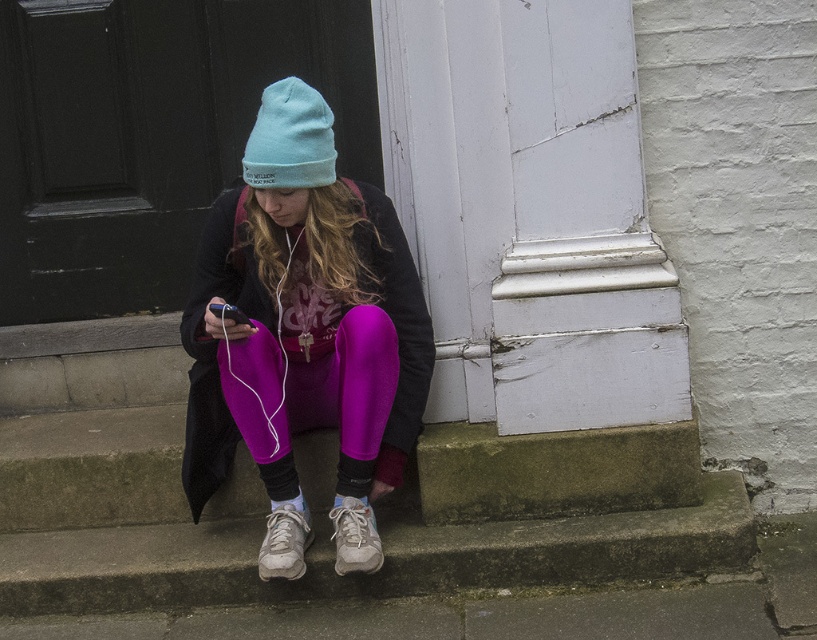
Does point (29, 545) lie in front of point (298, 497)?

No, (29, 545) is further to viewer.

Does point (677, 456) lie behind point (293, 504)?

No.

Which is behind, point (731, 508) or point (275, 500)?

Point (731, 508)

Where is `concrete stairs at center`? concrete stairs at center is located at coordinates (329, 504).

Is concrete stairs at center bigger than purple fleece pants at center?

Yes, concrete stairs at center is bigger than purple fleece pants at center.

Which is above, concrete stairs at center or purple fleece pants at center?

Positioned higher is purple fleece pants at center.

Is point (177, 580) farther from camera compared to point (335, 273)?

Yes.

Find the location of `concrete stairs at center`. concrete stairs at center is located at coordinates (329, 504).

Is point (355, 355) more distant than point (279, 504)?

No, (355, 355) is in front of (279, 504).

The image size is (817, 640). Find the location of `purple fleece pants at center`. purple fleece pants at center is located at coordinates (302, 308).

Does point (373, 321) come behind point (278, 504)?

No, (373, 321) is in front of (278, 504).

Find the location of a particular element. purple fleece pants at center is located at coordinates (302, 308).